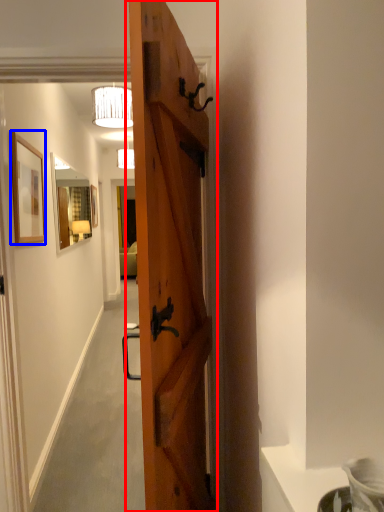
Question: Which object is further to the camera taking this photo, door (highlighted by a red box) or picture frame (highlighted by a blue box)?

Choices:
 (A) door
 (B) picture frame

Answer: (B)